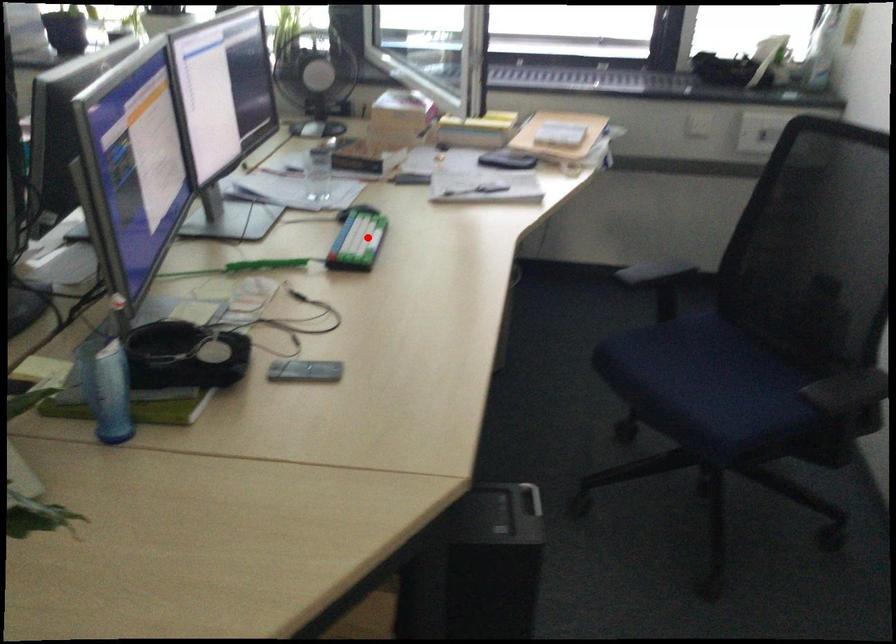
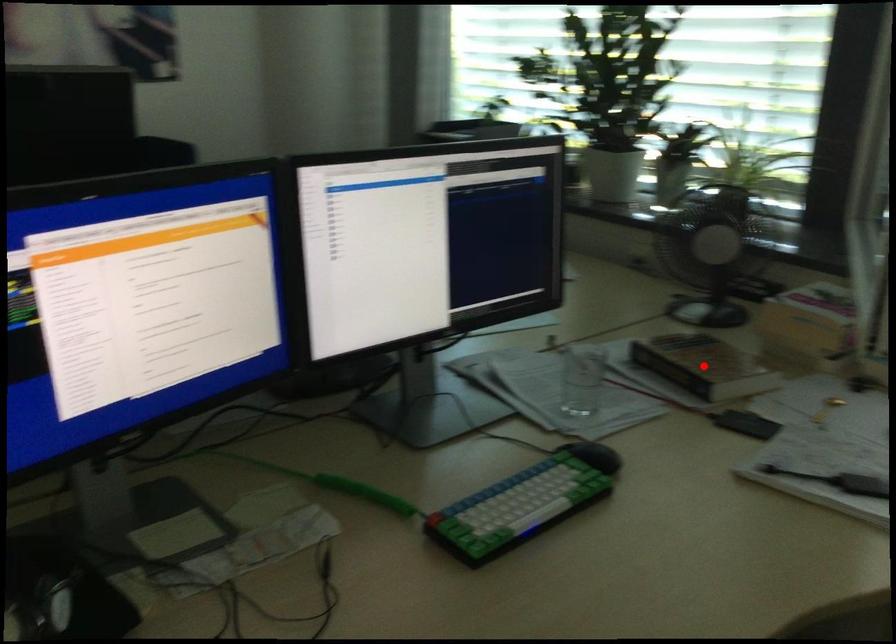
I am providing you with two images of the same scene from different viewpoints. A red point is marked on the first image and another point is marked on the second image. Does the point marked in image1 correspond to the same location as the one in image2?

No